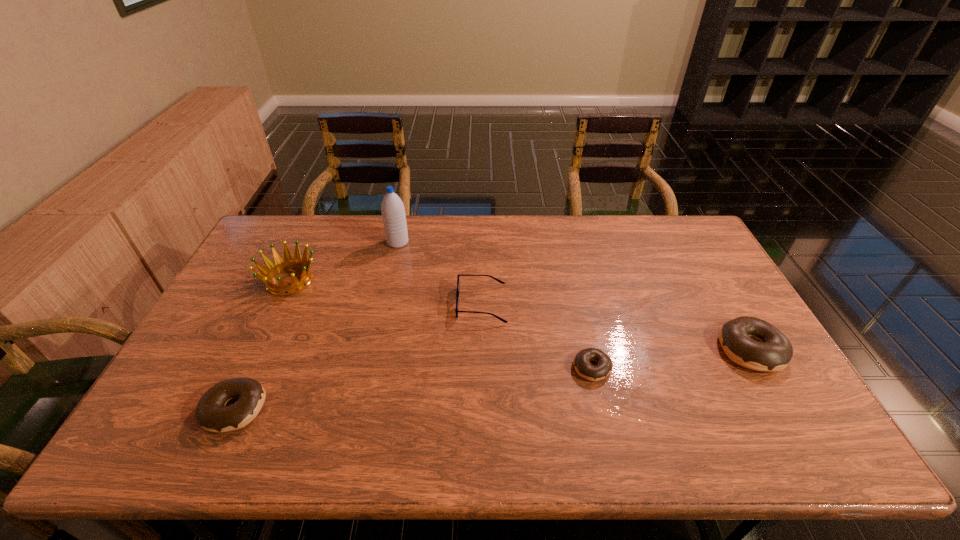
I want to click on blank space located 0.140m on the back of the rightmost doughnut, so click(718, 292).

Image resolution: width=960 pixels, height=540 pixels. Identify the location of vacant space located on the left of the tallest object. (288, 242).

Find the location of a particular element. free space located 0.220m on the right of the crown is located at coordinates (388, 281).

Locate an element on the screen. The width and height of the screenshot is (960, 540). vacant space located on the front-facing side of the fourth object from left to right is located at coordinates (388, 304).

Identify the location of free location located on the front-facing side of the fourth object from left to right. (368, 304).

Where is `free space located on the front-facing side of the fourth object from left to right`? free space located on the front-facing side of the fourth object from left to right is located at coordinates (365, 304).

This screenshot has height=540, width=960. In order to click on object positioned at the far edge in this screenshot , I will do [x=393, y=212].

What are the coordinates of `object positioned at the near edge` in the screenshot? It's located at (211, 413).

Locate an element on the screen. This screenshot has width=960, height=540. doughnut positioned at the left edge is located at coordinates (211, 413).

Image resolution: width=960 pixels, height=540 pixels. I want to click on crown situated at the left edge, so coord(272,269).